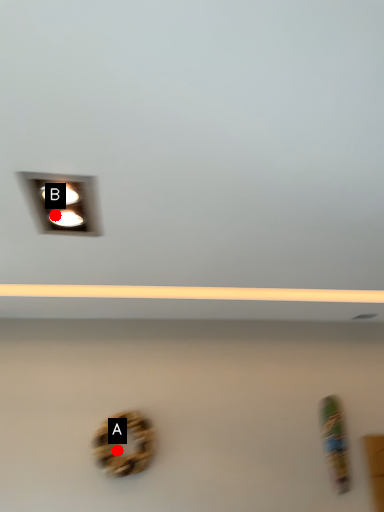
Question: Two points are circled on the image, labeled by A and B beside each circle. Which point is closer to the camera taking this photo?

Choices:
 (A) A is closer
 (B) B is closer

Answer: (A)